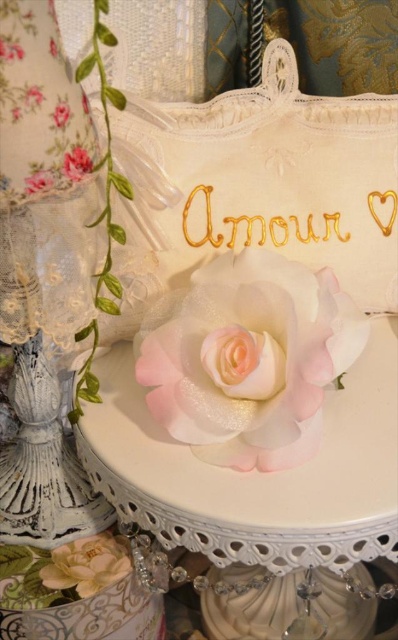
You are a florist arranging flowers for a client who wants to know which flower is taller between the matte white flower at lower left and the pink satin rose at center. Based on the scene description, which one is taller?

The matte white flower at lower left is much taller than the pink satin rose at center.

Consider the image. You are a florist arranging flowers for a romantic event. You have two pink satin roses. One is the pink satin rose at upper center and the other is the pink satin rose at center. Which rose should you choose if you want the taller one for the centerpiece?

The pink satin rose at upper center is taller than the pink satin rose at center, so you should choose the pink satin rose at upper center for the centerpiece.